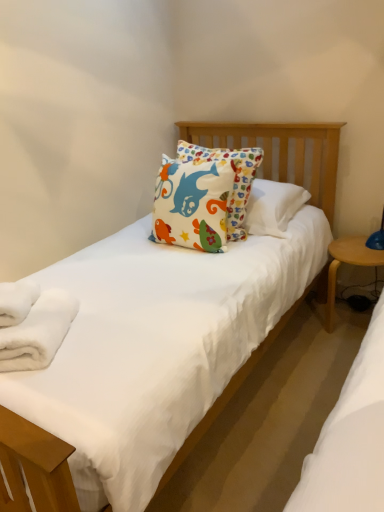
Question: Does white fluffy bath towel at lower left, placed as the second bath towel when sorted from top to bottom, have a lesser width compared to white soft towel at lower left, positioned as the 1th bath towel in top-to-bottom order?

Choices:
 (A) yes
 (B) no

Answer: (B)

Question: Considering the relative sizes of white fluffy bath towel at lower left, placed as the second bath towel when sorted from top to bottom, and white soft towel at lower left, the 2th bath towel when ordered from bottom to top, in the image provided, is white fluffy bath towel at lower left, placed as the second bath towel when sorted from top to bottom, shorter than white soft towel at lower left, the 2th bath towel when ordered from bottom to top,?

Choices:
 (A) yes
 (B) no

Answer: (B)

Question: Can you confirm if white fluffy bath towel at lower left, placed as the second bath towel when sorted from top to bottom, is positioned to the right of white soft towel at lower left, the 2th bath towel when ordered from bottom to top?

Choices:
 (A) no
 (B) yes

Answer: (B)

Question: Is white fluffy bath towel at lower left, placed as the second bath towel when sorted from top to bottom, facing away from white soft towel at lower left, positioned as the 1th bath towel in top-to-bottom order?

Choices:
 (A) yes
 (B) no

Answer: (B)

Question: From a real-world perspective, is white fluffy bath towel at lower left, placed as the second bath towel when sorted from top to bottom, on top of white soft towel at lower left, the 2th bath towel when ordered from bottom to top?

Choices:
 (A) no
 (B) yes

Answer: (A)

Question: Is white fluffy bath towel at lower left, placed as the second bath towel when sorted from top to bottom, taller than white soft towel at lower left, the 2th bath towel when ordered from bottom to top?

Choices:
 (A) yes
 (B) no

Answer: (A)

Question: Could you tell me if light wood/wooden table at right is turned towards white soft towel at lower left, the 2th bath towel when ordered from bottom to top?

Choices:
 (A) yes
 (B) no

Answer: (B)

Question: From a real-world perspective, is light wood/wooden table at right positioned over white soft towel at lower left, the 2th bath towel when ordered from bottom to top, based on gravity?

Choices:
 (A) yes
 (B) no

Answer: (B)

Question: Considering the relative sizes of light wood/wooden table at right and white soft towel at lower left, positioned as the 1th bath towel in top-to-bottom order, in the image provided, is light wood/wooden table at right taller than white soft towel at lower left, positioned as the 1th bath towel in top-to-bottom order,?

Choices:
 (A) yes
 (B) no

Answer: (A)

Question: Could white soft towel at lower left, the 2th bath towel when ordered from bottom to top, be considered to be inside light wood/wooden table at right?

Choices:
 (A) no
 (B) yes

Answer: (A)

Question: Can you confirm if light wood/wooden table at right is smaller than white soft towel at lower left, the 2th bath towel when ordered from bottom to top?

Choices:
 (A) yes
 (B) no

Answer: (B)

Question: Are light wood/wooden table at right and white soft towel at lower left, positioned as the 1th bath towel in top-to-bottom order, located far from each other?

Choices:
 (A) no
 (B) yes

Answer: (B)

Question: From a real-world perspective, does white soft towel at lower left, the 2th bath towel when ordered from bottom to top, stand above white fluffy bath towel at lower left, which is counted as the 1th bath towel, starting from the bottom?

Choices:
 (A) no
 (B) yes

Answer: (B)